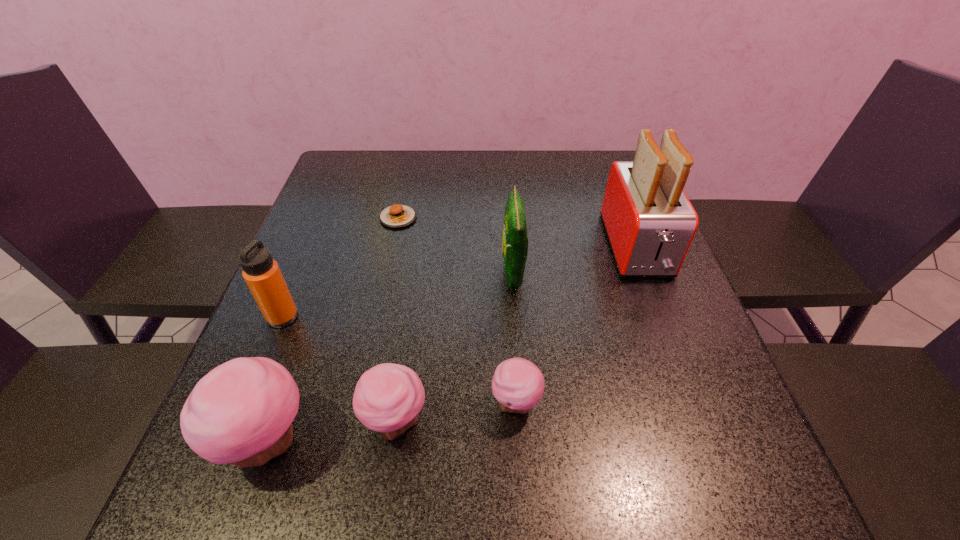
Locate an element on the screen. The image size is (960, 540). vacant spot to place a cupcake on the right is located at coordinates (629, 387).